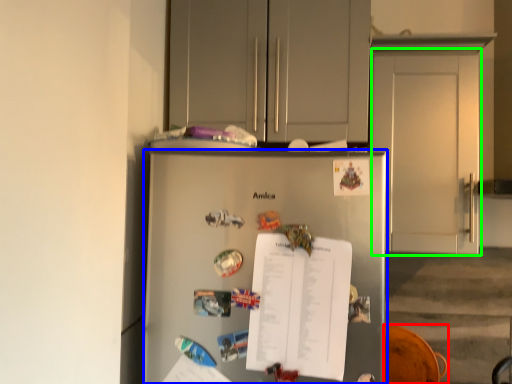
Question: Which object is the farthest from swivel chair (highlighted by a red box)? Choose among these: refrigerator (highlighted by a blue box) or door (highlighted by a green box).

Choices:
 (A) refrigerator
 (B) door

Answer: (A)